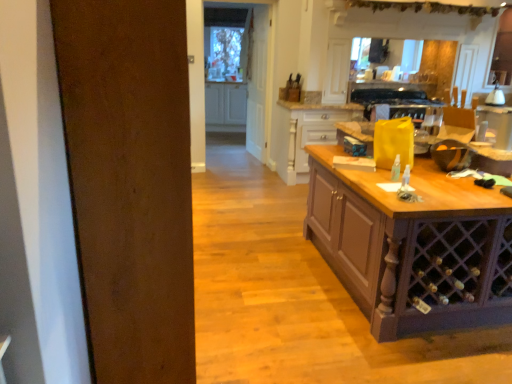
Question: Is wooden drawer at center, placed as the first cabinetry when sorted from bottom to top, oriented towards white wood door at center?

Choices:
 (A) yes
 (B) no

Answer: (B)

Question: Is wooden drawer at center, placed as the first cabinetry when sorted from right to left, positioned behind white wood door at center?

Choices:
 (A) yes
 (B) no

Answer: (B)

Question: Is wooden drawer at center, placed as the second cabinetry when sorted from left to right, turned away from white wood door at center?

Choices:
 (A) no
 (B) yes

Answer: (B)

Question: From the image's perspective, is wooden drawer at center, placed as the first cabinetry when sorted from right to left, on white wood door at center?

Choices:
 (A) no
 (B) yes

Answer: (A)

Question: Is wooden drawer at center, placed as the first cabinetry when sorted from bottom to top, at the left side of white wood door at center?

Choices:
 (A) no
 (B) yes

Answer: (A)

Question: Is wooden drawer at center, placed as the 1th cabinetry when sorted from front to back, shorter than white wood door at center?

Choices:
 (A) no
 (B) yes

Answer: (B)

Question: Considering the relative positions of wooden drawer at center, the second cabinetry viewed from the back, and white glossy cabinet at center, arranged as the 1th cabinetry when viewed from the back, in the image provided, is wooden drawer at center, the second cabinetry viewed from the back, to the left of white glossy cabinet at center, arranged as the 1th cabinetry when viewed from the back, from the viewer's perspective?

Choices:
 (A) yes
 (B) no

Answer: (B)

Question: Would you say wooden drawer at center, placed as the second cabinetry when sorted from left to right, is outside white glossy cabinet at center, the 2th cabinetry positioned from the front?

Choices:
 (A) no
 (B) yes

Answer: (B)

Question: From a real-world perspective, is wooden drawer at center, placed as the first cabinetry when sorted from bottom to top, beneath white glossy cabinet at center, the 2th cabinetry positioned from the front?

Choices:
 (A) yes
 (B) no

Answer: (A)

Question: From the image's perspective, is wooden drawer at center, placed as the first cabinetry when sorted from right to left, below white glossy cabinet at center, which is the 2th cabinetry from right to left?

Choices:
 (A) no
 (B) yes

Answer: (B)

Question: Is wooden drawer at center, placed as the second cabinetry when sorted from left to right, smaller than white glossy cabinet at center, the second cabinetry positioned from the bottom?

Choices:
 (A) yes
 (B) no

Answer: (B)

Question: Considering the relative sizes of wooden drawer at center, placed as the second cabinetry when sorted from left to right, and white glossy cabinet at center, the 1th cabinetry when ordered from top to bottom, in the image provided, is wooden drawer at center, placed as the second cabinetry when sorted from left to right, shorter than white glossy cabinet at center, the 1th cabinetry when ordered from top to bottom,?

Choices:
 (A) yes
 (B) no

Answer: (B)

Question: Is white glossy cabinet at center, the 2th cabinetry positioned from the front, bigger than white wood door at center?

Choices:
 (A) yes
 (B) no

Answer: (A)